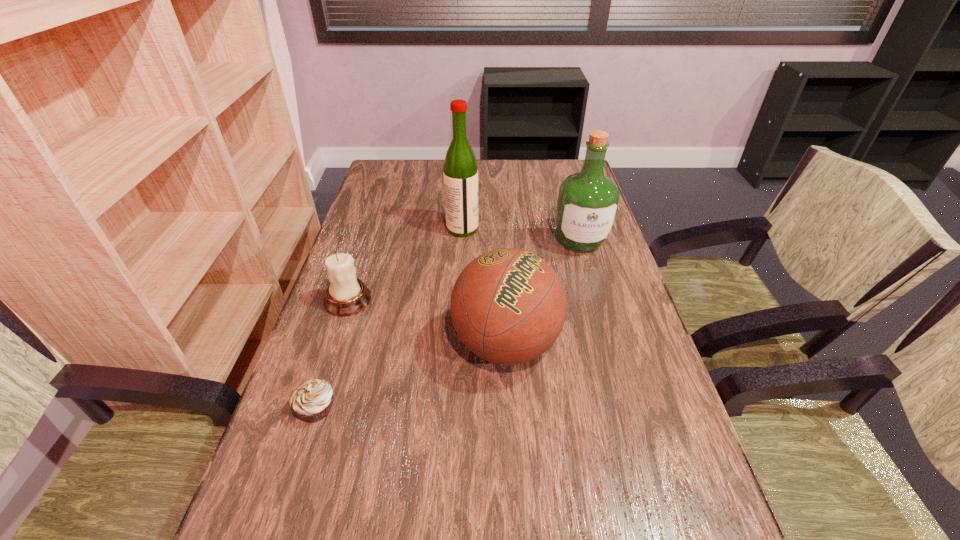
Identify the location of blank space located 0.170m on the right of the shortest object. (422, 408).

In order to click on candle holder at the left edge in this screenshot , I will do `click(346, 295)`.

Find the location of a particular element. This screenshot has width=960, height=540. muffin that is positioned at the left edge is located at coordinates (311, 402).

Locate an element on the screen. object that is at the right edge is located at coordinates (588, 201).

The height and width of the screenshot is (540, 960). What are the coordinates of `vacant space at the left edge of the desktop` in the screenshot? It's located at (387, 220).

This screenshot has width=960, height=540. I want to click on free space at the right edge of the desktop, so click(602, 292).

What are the coordinates of `blank space at the far left corner of the desktop` in the screenshot? It's located at (403, 190).

I want to click on vacant space that's between the nearest object and the right liquor, so click(x=448, y=325).

The height and width of the screenshot is (540, 960). What are the coordinates of `free area in between the basketball and the nearest object` in the screenshot? It's located at (411, 376).

What are the coordinates of `vacant area that lies between the muffin and the second shortest object` in the screenshot? It's located at pos(332,354).